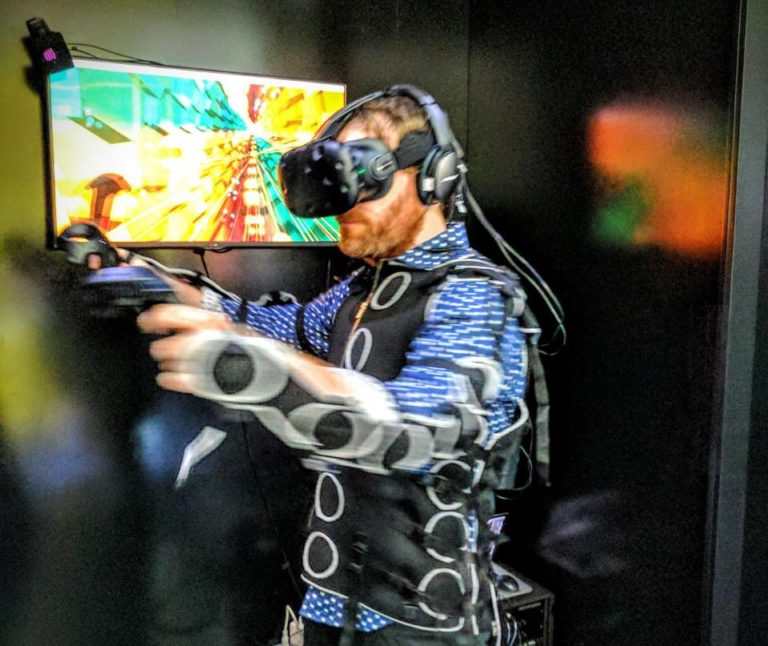
I want to click on reflection of screen on black wall, so click(x=700, y=126), click(x=614, y=238), click(x=709, y=236), click(x=601, y=115).